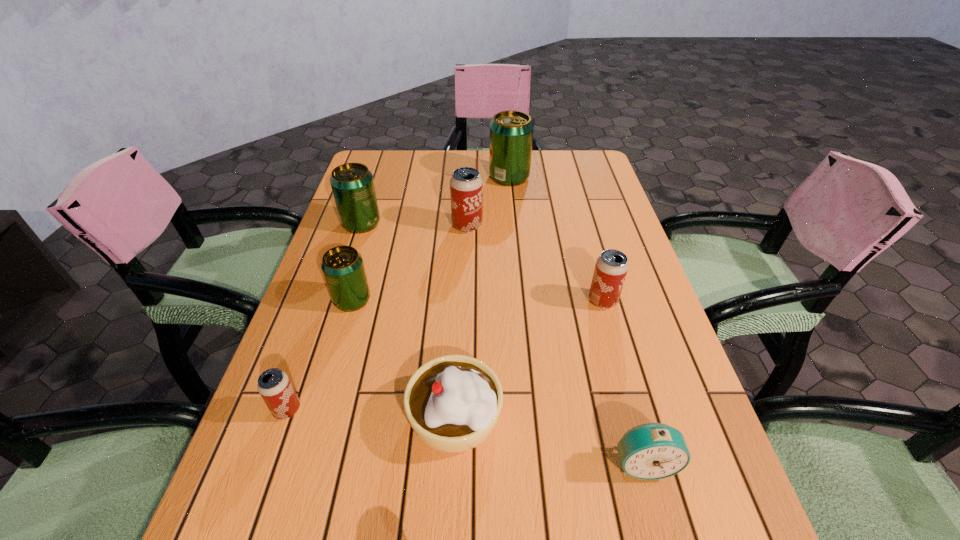
Locate an element on the screen. The width and height of the screenshot is (960, 540). the farthest beer can is located at coordinates (511, 132).

Identify the location of the farthest green beer can. This screenshot has width=960, height=540. (511, 132).

You are a GUI agent. You are given a task and a screenshot of the screen. Output one action in this format:
    pyautogui.click(x=<x>, y=<y>)
    Task: Click on the third beer can from right to left
    
    Given the screenshot: What is the action you would take?
    pyautogui.click(x=466, y=186)

The image size is (960, 540). What are the coordinates of `the farthest red beer can` in the screenshot? It's located at (466, 186).

At what (x,y) coordinates should I click in order to perform the action: click on the second biggest green beer can. Please return your answer as a coordinate pair (x, y). Looking at the image, I should click on (352, 184).

At what (x,y) coordinates should I click in order to perform the action: click on the smallest green beer can. Please return your answer as a coordinate pair (x, y). The width and height of the screenshot is (960, 540). Looking at the image, I should click on pos(342,266).

The width and height of the screenshot is (960, 540). Find the location of `the rightmost beer can`. the rightmost beer can is located at coordinates (611, 267).

Find the location of a particular element. the second nearest red beer can is located at coordinates (611, 267).

Identify the location of beige whipped cream. (453, 402).

In order to click on alarm clock in this screenshot , I will do `click(651, 451)`.